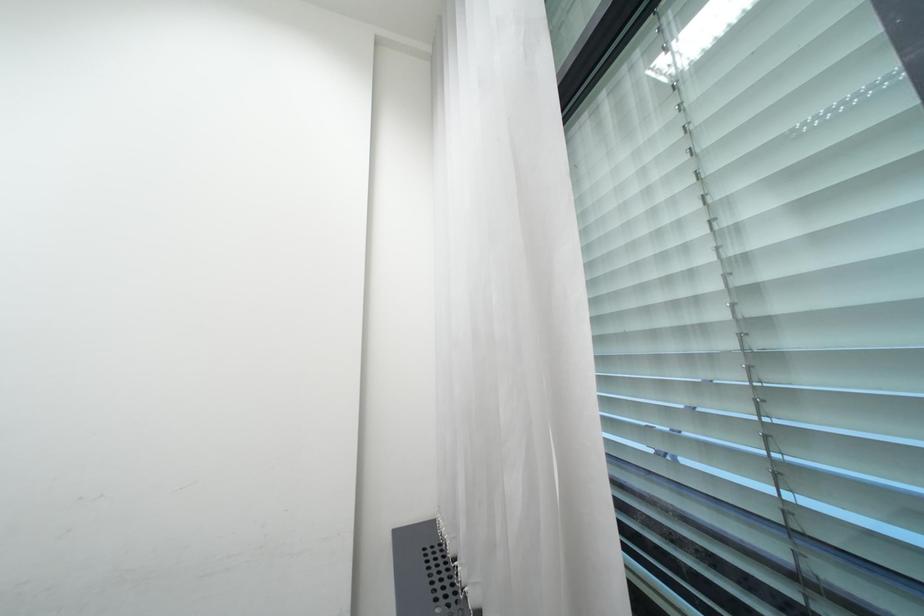
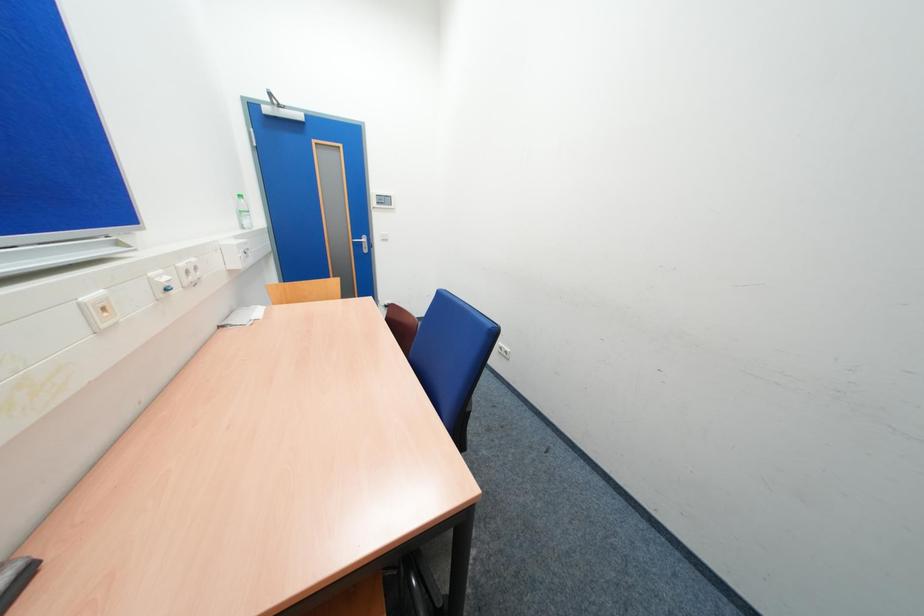
First-person continuous shooting, in which direction is the camera rotating?

The rotation direction of the camera is left-down.